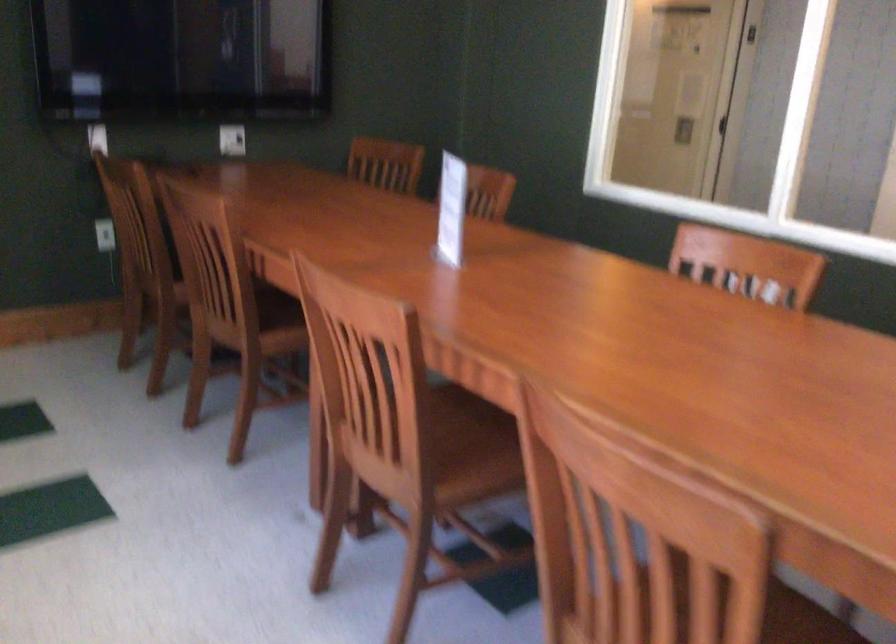
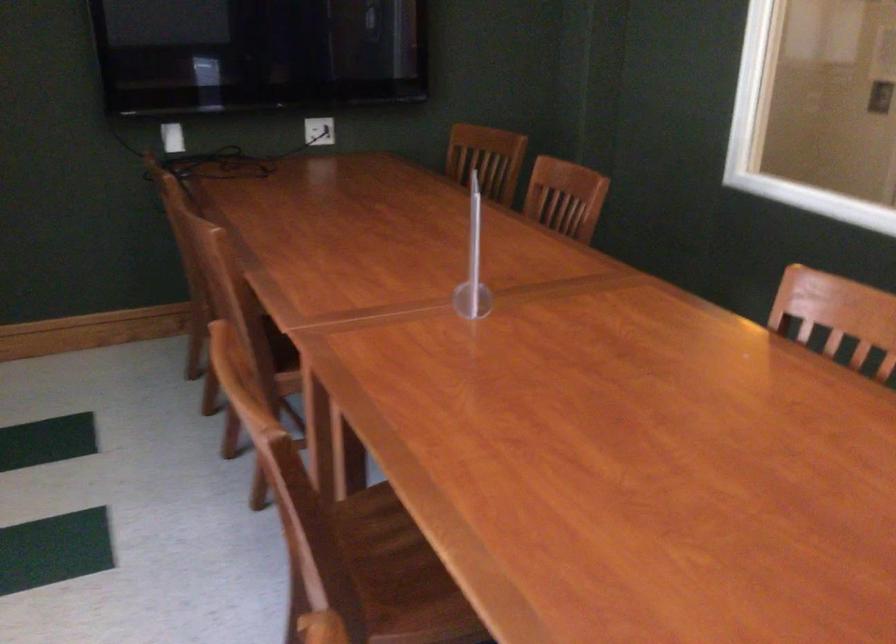
In the second image, find the point that corresponds to point 428,237 in the first image.

(472, 263)